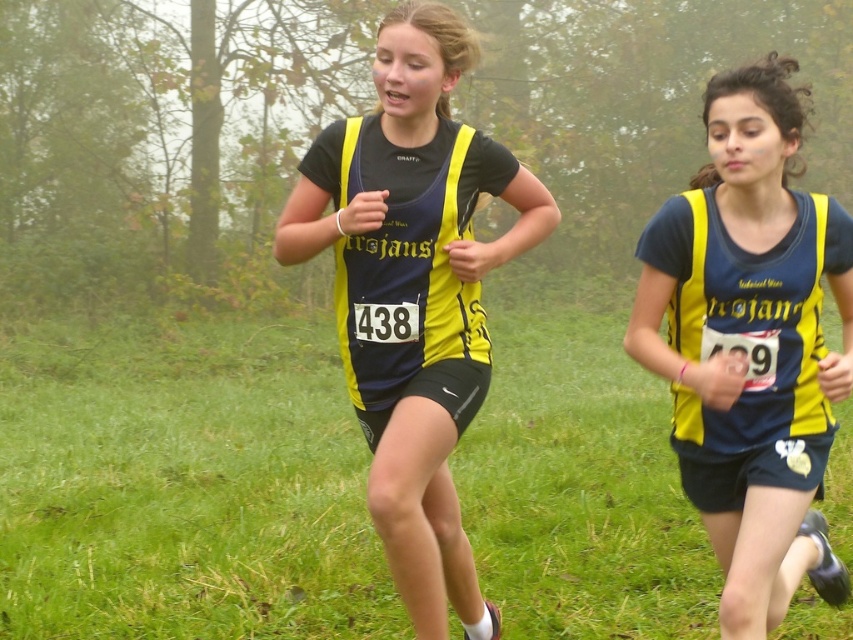
Describe the element at coordinates (750, 344) in the screenshot. The height and width of the screenshot is (640, 853). I see `matte yellow vest at center` at that location.

Which is in front, point (749, 563) or point (422, 284)?

Point (749, 563) is more forward.

Does point (776, 125) come closer to viewer compared to point (386, 444)?

Yes, point (776, 125) is in front of point (386, 444).

Find the location of `matte yellow vest at center`. matte yellow vest at center is located at coordinates (750, 344).